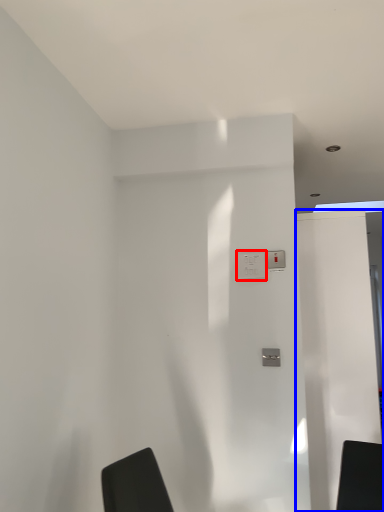
Question: Which object is further to the camera taking this photo, electric outlet (highlighted by a red box) or screen door (highlighted by a blue box)?

Choices:
 (A) electric outlet
 (B) screen door

Answer: (B)